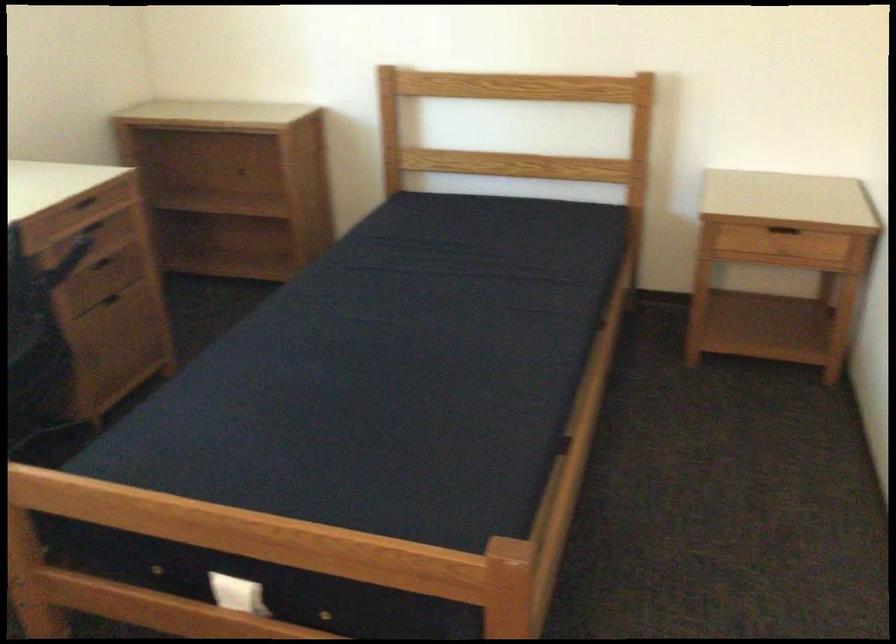
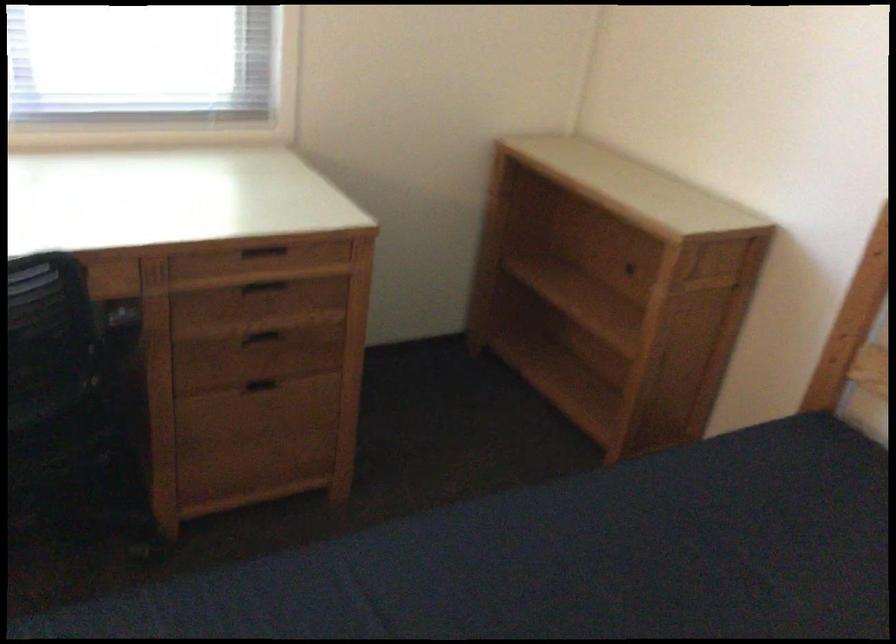
In the second image, find the point that corresponds to the point at 82,277 in the first image.

(264, 333)